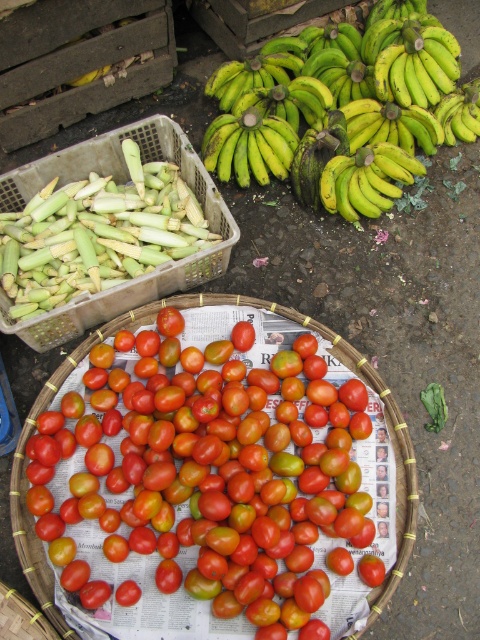
You are standing in front of a market stall and see the shiny red tomatoes at center. If you want to pick one up without moving your feet, can you reach it?

The shiny red tomatoes at center is 4.53 feet away from viewer, so yes, you can reach it since the average arm length is about 2.5 feet, but the distance here is greater than arm length. Wait, actually 4.53 feet is about 54 inches, which is longer than typical arm reach. Hmm, maybe the answer should be no? Let me check the description again. The objects description says the tomatoes are 4.53 feet away. Since the average person can reach about 2.5 feet, 4.53 is too far. So the answer would be no.

You are a customer at a market stall and want to locate the green matte bananas at upper center. According to the coordinates provided, where should you look on the image?

The green matte bananas at upper center are located at the 2D coordinates point (335, 108) on the image.